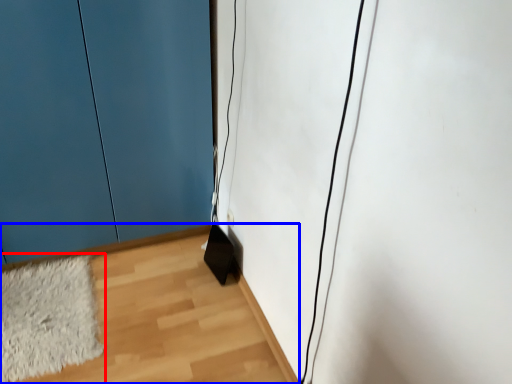
Question: Among these objects, which one is nearest to the camera, mat (highlighted by a red box) or corridor (highlighted by a blue box)?

Choices:
 (A) mat
 (B) corridor

Answer: (B)